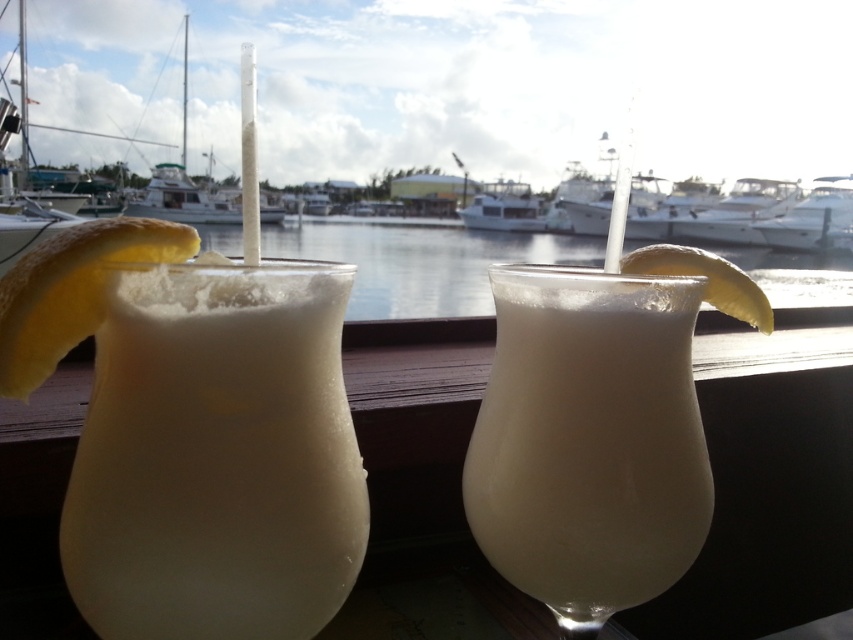
Is yellow matte lemon at right positioned in front of white glossy boat at center?

Yes, yellow matte lemon at right is in front of white glossy boat at center.

In the scene shown: Which of these two, yellow matte lemon at right or white glossy boat at center, stands shorter?

Standing shorter between the two is yellow matte lemon at right.

The image size is (853, 640). Identify the location of yellow matte lemon at right. (706, 280).

Where is `yellow matte lemon at right`? yellow matte lemon at right is located at coordinates (706, 280).

This screenshot has height=640, width=853. What do you see at coordinates (73, 291) in the screenshot?
I see `yellow matte lemon at left` at bounding box center [73, 291].

Is point (33, 291) positioned before point (798, 236)?

Yes.

The width and height of the screenshot is (853, 640). What do you see at coordinates (73, 291) in the screenshot? I see `yellow matte lemon at left` at bounding box center [73, 291].

Where is `yellow matte lemon at left`? yellow matte lemon at left is located at coordinates (73, 291).

Can you confirm if white frothy drink at left is taller than yellow matte lemon at left?

Yes, white frothy drink at left is taller than yellow matte lemon at left.

Between point (161, 538) and point (115, 228), which one is positioned in front?

Point (115, 228) is in front.

Which is behind, point (235, 353) or point (24, 330)?

The point (235, 353) is behind.

What are the coordinates of `white frothy drink at left` in the screenshot? It's located at (218, 458).